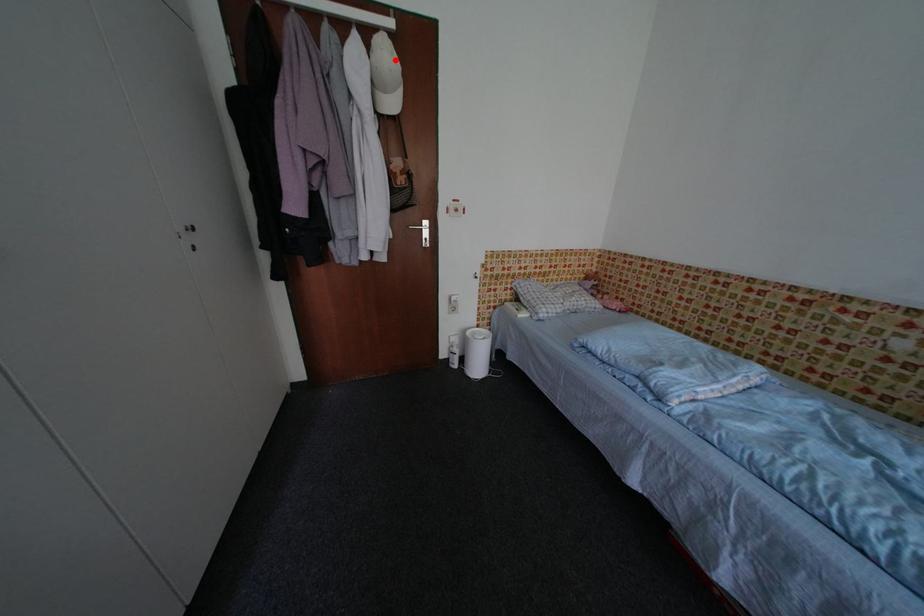
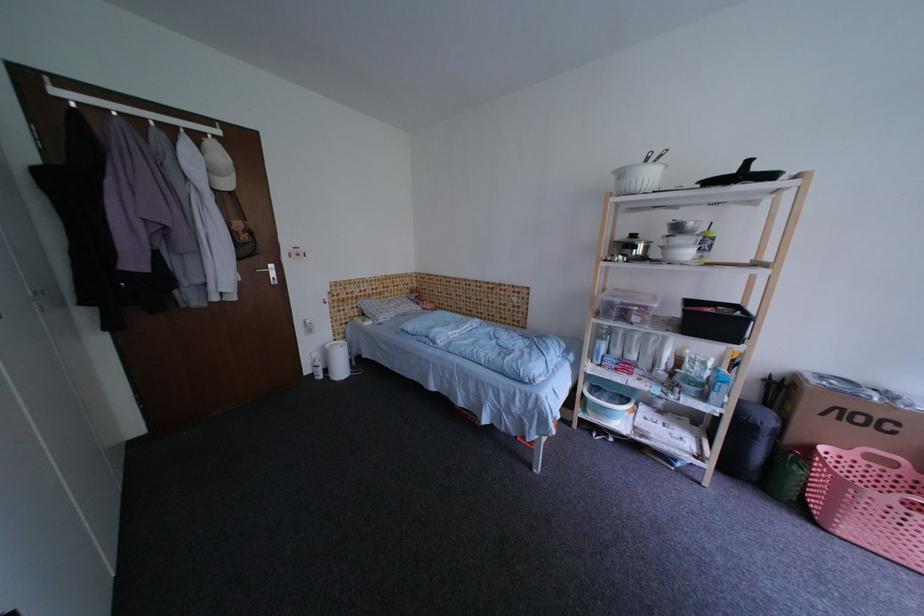
Where in the second image is the point corresponding to the highlighted location from the first image?

(227, 158)